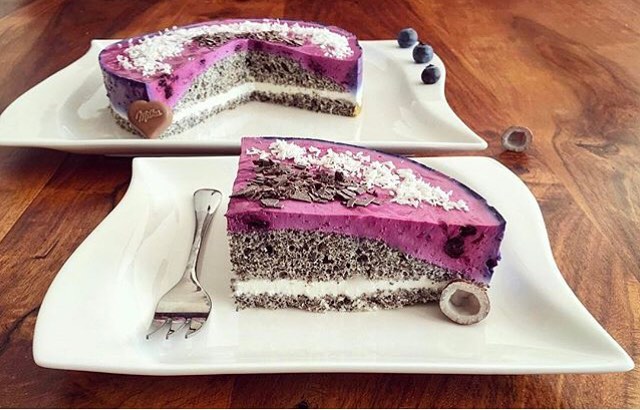
Image resolution: width=640 pixels, height=410 pixels. What are the coordinates of `fork` in the screenshot? It's located at (186, 329).